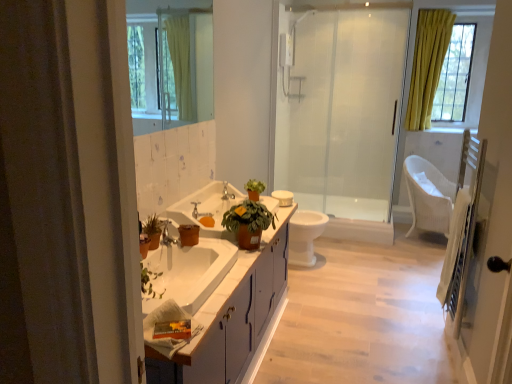
You are a GUI agent. You are given a task and a screenshot of the screen. Output one action in this format:
    pyautogui.click(x=<x>, y=<y>)
    Task: Click on the matte silver faucet at center, the second tap viewed from the right
    
    Given the screenshot: What is the action you would take?
    pyautogui.click(x=199, y=212)

This screenshot has width=512, height=384. What do you see at coordinates (298, 86) in the screenshot?
I see `white plastic towel bar at upper center` at bounding box center [298, 86].

What do you see at coordinates (455, 76) in the screenshot? I see `yellow fabric curtain at upper right` at bounding box center [455, 76].

The image size is (512, 384). What do you see at coordinates (231, 317) in the screenshot?
I see `white glossy cabinet at center` at bounding box center [231, 317].

At what (x,y) coordinates should I click in order to perform the action: click on white glossy toilet bowl at center. Please return your answer as a coordinate pair (x, y). Image resolution: width=512 pixels, height=384 pixels. Looking at the image, I should click on (305, 236).

You are a GUI agent. You are given a task and a screenshot of the screen. Output one action in this format:
    pyautogui.click(x=<x>, y=<y>)
    Task: Click on the clear glass mirror at upper center
    This screenshot has height=384, width=512.
    Given the screenshot: What is the action you would take?
    click(x=169, y=66)

From a real-world perspective, which is physically below, white wooden screen door at right or white glossy sink at center?

From a 3D spatial view, white glossy sink at center is below.

Considering the relative positions of white wooden screen door at right and white glossy sink at center in the image provided, is white wooden screen door at right to the left or to the right of white glossy sink at center?

white wooden screen door at right is positioned on white glossy sink at center's right side.

Is white glossy sink at center a part of white wooden screen door at right?

No, white glossy sink at center is not inside white wooden screen door at right.

Considering the sizes of white wooden screen door at right and white glossy sink at center in the image, is white wooden screen door at right wider or thinner than white glossy sink at center?

Considering their sizes, white wooden screen door at right looks slimmer than white glossy sink at center.

From the image's perspective, is white glossy toilet bowl at center positioned above or below white glossy cabinet at center?

Based on their image positions, white glossy toilet bowl at center is located above white glossy cabinet at center.

Would you say white glossy toilet bowl at center is inside or outside white glossy cabinet at center?

white glossy toilet bowl at center is not inside white glossy cabinet at center, it's outside.

Between point (317, 226) and point (218, 374), which one is positioned behind?

Positioned behind is point (317, 226).

Is matte silver faucet at center, which is the first tap in front-to-back order, oriented towards white plastic towel bar at upper center?

No, matte silver faucet at center, which is the first tap in front-to-back order, is not turned towards white plastic towel bar at upper center.

Can you tell me how much matte silver faucet at center, which appears as the 2th tap when viewed from the back, and white plastic towel bar at upper center differ in facing direction?

43.1 degrees separate the facing orientations of matte silver faucet at center, which appears as the 2th tap when viewed from the back, and white plastic towel bar at upper center.

Is matte silver faucet at center, which appears as the 2th tap when viewed from the back, spatially inside white plastic towel bar at upper center, or outside of it?

matte silver faucet at center, which appears as the 2th tap when viewed from the back, is not inside white plastic towel bar at upper center, it's outside.

From the image's perspective, between matte silver faucet at center, which appears as the 2th tap when viewed from the back, and white plastic towel bar at upper center, which one is located above?

white plastic towel bar at upper center appears higher in the image.

Which point is more forward, [226,193] or [181,200]?

Positioned in front is point [181,200].

From a real-world perspective, is silver metallic tap at center, which is the first tap in back-to-front order, positioned over white glossy sink at center based on gravity?

Correct, in the physical world, silver metallic tap at center, which is the first tap in back-to-front order, is higher than white glossy sink at center.

Does silver metallic tap at center, placed as the 2th tap when sorted from front to back, come behind white glossy sink at center?

That is True.

Are silver metallic tap at center, which is the first tap in back-to-front order, and white glossy sink at center far apart?

No, silver metallic tap at center, which is the first tap in back-to-front order, is not far from white glossy sink at center.

Would you say transparent glass shower door at center is outside silver metallic tap at center, arranged as the 2th tap when viewed from the left?

Indeed, transparent glass shower door at center is completely outside silver metallic tap at center, arranged as the 2th tap when viewed from the left.

From a real-world perspective, which object rests below the other?

From a 3D spatial view, silver metallic tap at center, placed as the 2th tap when sorted from front to back, is below.

Where is `shower door above the silver metallic tap at center, marked as the first tap in a right-to-left arrangement (from a real-world perspective)`? This screenshot has width=512, height=384. shower door above the silver metallic tap at center, marked as the first tap in a right-to-left arrangement (from a real-world perspective) is located at coordinates (342, 117).

From the image's perspective, which is below, white glossy sink at center or white glossy cabinet at center?

white glossy cabinet at center, from the image's perspective.

Which is in front, point (213, 192) or point (274, 241)?

The point (274, 241) is closer to the camera.

Does white glossy sink at center have a lesser width compared to white glossy cabinet at center?

Correct, the width of white glossy sink at center is less than that of white glossy cabinet at center.

What's the angular difference between white glossy sink at center and white glossy cabinet at center's facing directions?

The angle between the facing direction of white glossy sink at center and the facing direction of white glossy cabinet at center is 0.648 degrees.

Is there a large distance between white wooden screen door at right and matte silver faucet at center, which appears as the 2th tap when viewed from the back?

Yes, white wooden screen door at right and matte silver faucet at center, which appears as the 2th tap when viewed from the back, are quite far apart.

Who is smaller, white wooden screen door at right or matte silver faucet at center, which appears as the 2th tap when viewed from the back?

With smaller size is matte silver faucet at center, which appears as the 2th tap when viewed from the back.

From a real-world perspective, is white wooden screen door at right physically located above or below matte silver faucet at center, acting as the 1th tap starting from the left?

Clearly, from a real-world perspective, white wooden screen door at right is above matte silver faucet at center, acting as the 1th tap starting from the left.

This screenshot has height=384, width=512. What are the coordinates of `screen door lying below the white glossy sink at center (from the image's perspective)` in the screenshot? It's located at (490, 224).

You are a GUI agent. You are given a task and a screenshot of the screen. Output one action in this format:
    pyautogui.click(x=<x>, y=<y>)
    Task: Click on the toilet bowl lying above the white glossy cabinet at center (from the image's perspective)
    This screenshot has height=384, width=512.
    Given the screenshot: What is the action you would take?
    pyautogui.click(x=305, y=236)

Estimate the real-world distances between objects in this image. Which object is further from transparent glass shower door at center, silver metallic tap at center, placed as the 2th tap when sorted from front to back, or white wooden screen door at right?

white wooden screen door at right lies further to transparent glass shower door at center than the other object.

Estimate the real-world distances between objects in this image. Which object is further from silver metallic tap at center, placed as the 2th tap when sorted from front to back, transparent glass shower door at center or clear glass mirror at upper center?

transparent glass shower door at center lies further to silver metallic tap at center, placed as the 2th tap when sorted from front to back, than the other object.

Estimate the real-world distances between objects in this image. Which object is further from white glossy toilet bowl at center, clear glass mirror at upper center or white plastic towel bar at upper center?

Among the two, clear glass mirror at upper center is located further to white glossy toilet bowl at center.

Considering their positions, is brushed metal faucet at center positioned further to yellow fabric curtain at upper right than silver metallic tap at center, marked as the first tap in a right-to-left arrangement?

brushed metal faucet at center is positioned further to the anchor yellow fabric curtain at upper right.

Considering their positions, is brushed metal faucet at center positioned further to white wooden screen door at right than white glossy toilet bowl at center?

brushed metal faucet at center is positioned further to the anchor white wooden screen door at right.

Based on their spatial positions, is white plastic towel bar at upper center or clear glass mirror at upper center further from transparent glass shower door at center?

clear glass mirror at upper center lies further to transparent glass shower door at center than the other object.

From the image, which object appears to be nearer to yellow fabric curtain at upper right, white plastic towel bar at upper center or silver metallic tap at center, placed as the 2th tap when sorted from front to back?

white plastic towel bar at upper center.

Which object lies nearer to the anchor point yellow fabric curtain at upper right, white glossy sink at center or white glossy toilet bowl at center?

Among the two, white glossy toilet bowl at center is located nearer to yellow fabric curtain at upper right.

The width and height of the screenshot is (512, 384). What are the coordinates of `bathroom cabinet positioned between white wooden screen door at right and white glossy sink at center from near to far` in the screenshot? It's located at (231, 317).

Identify the location of faucet between white glossy cabinet at center and transparent glass shower door at center from front to back. (167, 234).

The width and height of the screenshot is (512, 384). I want to click on bathroom cabinet located between white wooden screen door at right and brushed metal faucet at center in the depth direction, so click(231, 317).

The width and height of the screenshot is (512, 384). I want to click on mirror between white wooden screen door at right and yellow fabric curtain at upper right along the z-axis, so click(169, 66).